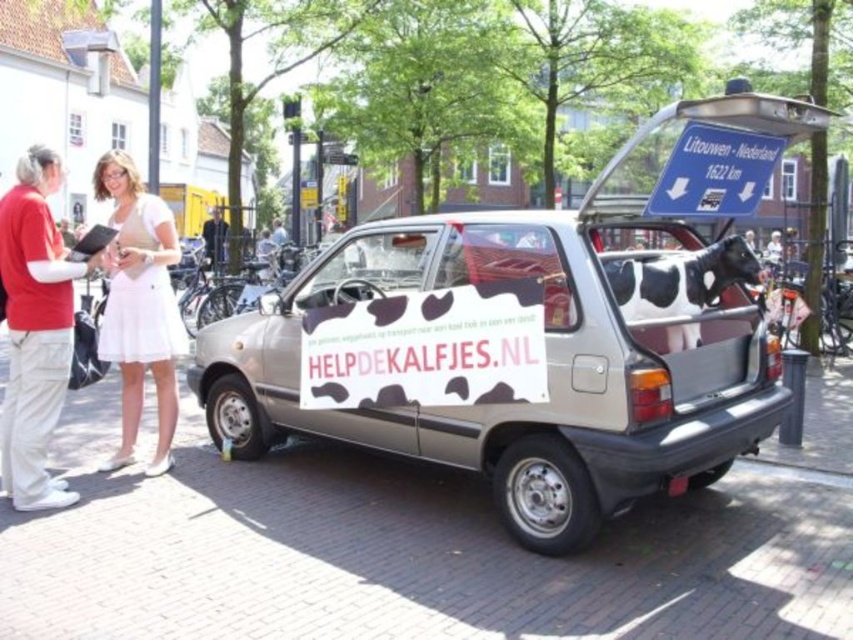
Question: Does red cotton shirt at left have a greater width compared to white fabric skirt at left?

Choices:
 (A) yes
 (B) no

Answer: (A)

Question: Among these objects, which one is farthest from the camera?

Choices:
 (A) dark gray shirt at center
 (B) white fabric skirt at left

Answer: (A)

Question: Among these objects, which one is farthest from the camera?

Choices:
 (A) white fabric skirt at left
 (B) dark gray shirt at center

Answer: (B)

Question: Which point is farther from the camera taking this photo?

Choices:
 (A) (148, 241)
 (B) (218, 260)

Answer: (B)

Question: Is red cotton shirt at left bigger than dark gray shirt at center?

Choices:
 (A) yes
 (B) no

Answer: (B)

Question: Is the position of red cotton shirt at left less distant than that of white fabric skirt at left?

Choices:
 (A) no
 (B) yes

Answer: (B)